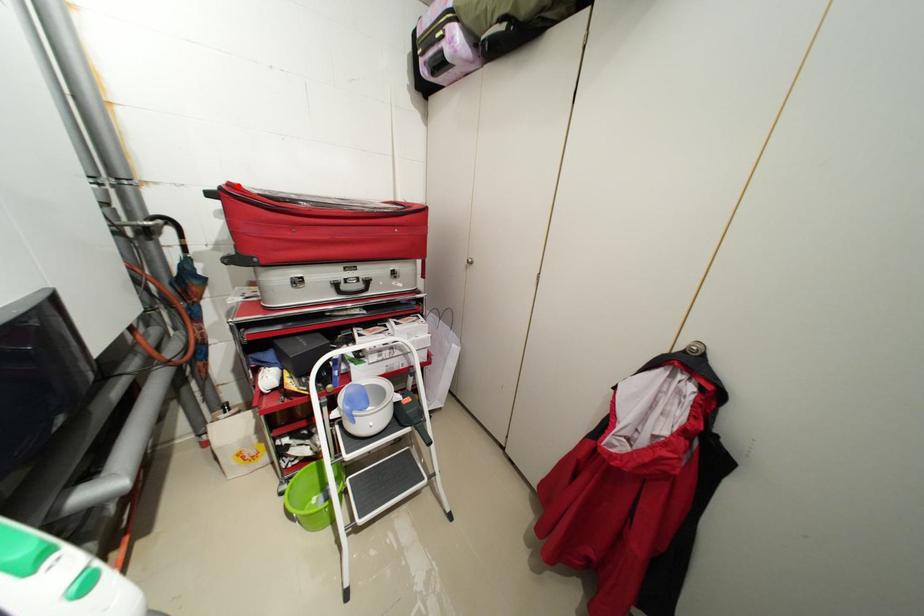
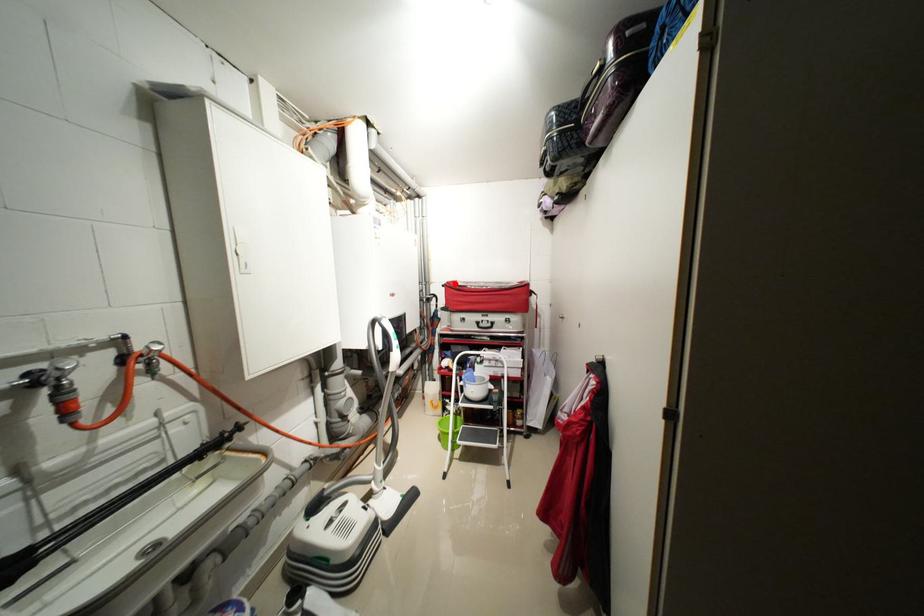
I am providing you with two images of the same scene from different viewpoints. A red point is marked on the first image and another point is marked on the second image. Do the highlighted points in image1 and image2 indicate the same real-world spot?

Yes